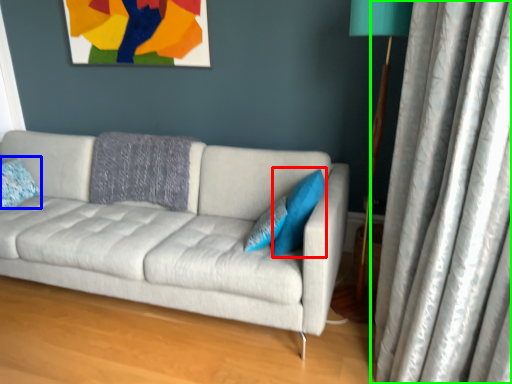
Question: Estimate the real-world distances between objects in this image. Which object is closer to pillow (highlighted by a red box), pillow (highlighted by a blue box) or curtain (highlighted by a green box)?

Choices:
 (A) pillow
 (B) curtain

Answer: (B)